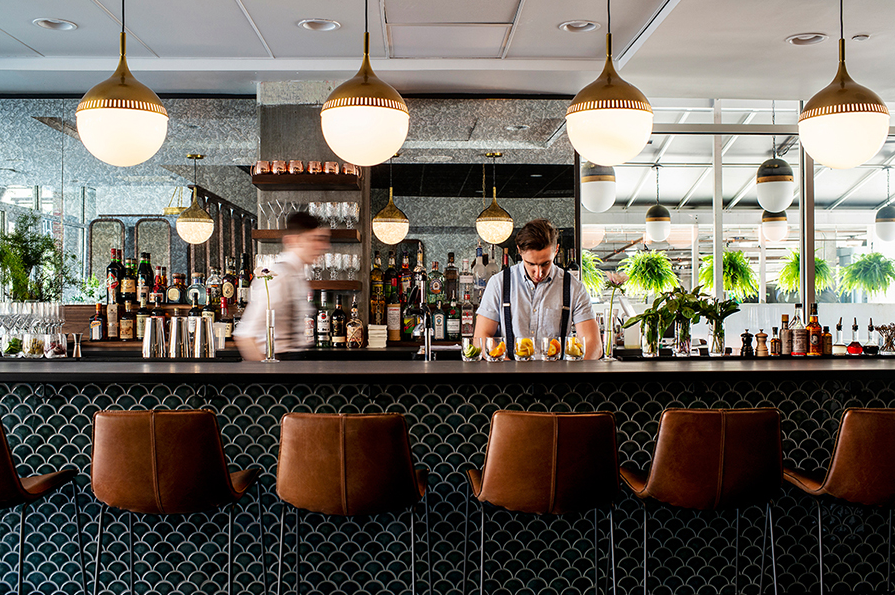
Locate an element on the screen. The image size is (895, 595). salt and pepper shakers is located at coordinates (742, 339), (760, 347).